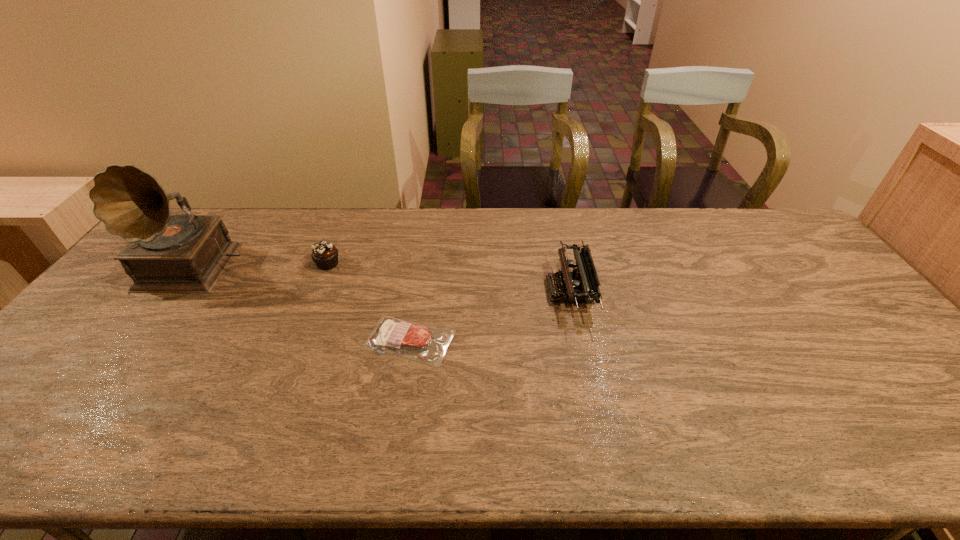
You are a GUI agent. You are given a task and a screenshot of the screen. Output one action in this format:
    pyautogui.click(x=<x>, y=<y>)
    Task: Click on the tallest object
    The image size is (960, 540).
    Given the screenshot: What is the action you would take?
    pyautogui.click(x=186, y=253)

The image size is (960, 540). In order to click on the leftmost object in this screenshot , I will do `click(186, 253)`.

Identify the location of typewriter. (581, 285).

Identify the location of the rightmost object. (581, 285).

What are the coordinates of `the second object from left to right` in the screenshot? It's located at (325, 255).

Find the location of `cupcake`. cupcake is located at coordinates (325, 255).

You are a GUI agent. You are given a task and a screenshot of the screen. Output one action in this format:
    pyautogui.click(x=<x>, y=<y>)
    Task: Click on the shortest object
    The height and width of the screenshot is (540, 960).
    Given the screenshot: What is the action you would take?
    pyautogui.click(x=426, y=344)

I want to click on steak, so [x=426, y=344].

The width and height of the screenshot is (960, 540). Find the location of `vacant area situated from the horn of the leftmost object`. vacant area situated from the horn of the leftmost object is located at coordinates (105, 394).

Locate an element on the screen. blank space located 0.270m on the typing side of the second tallest object is located at coordinates (455, 291).